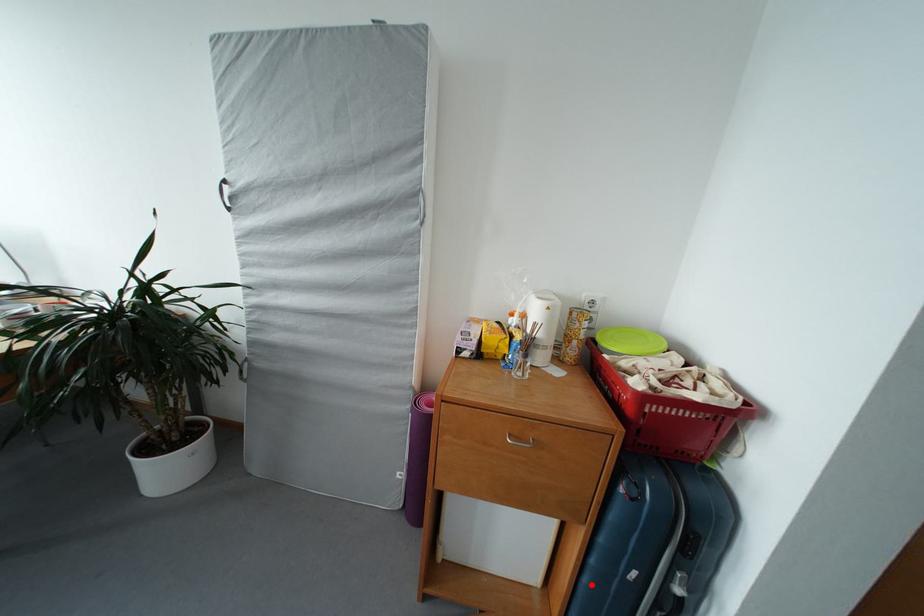
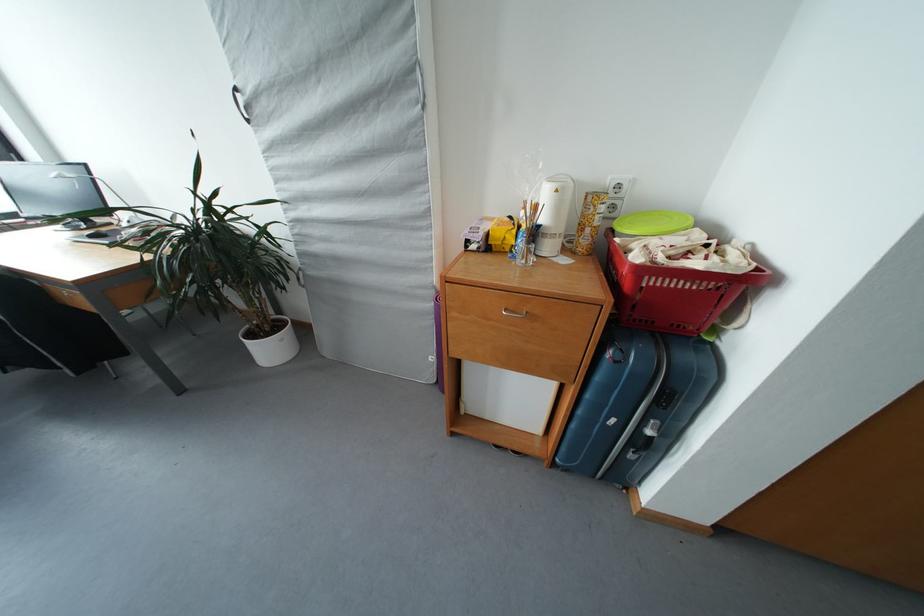
Question: I am providing you with two images of the same scene from different viewpoints. Given a red point in image1, look at the same physical point in image2. Is it:

Choices:
 (A) Closer to the viewpoint
 (B) Farther from the viewpoint

Answer: (B)